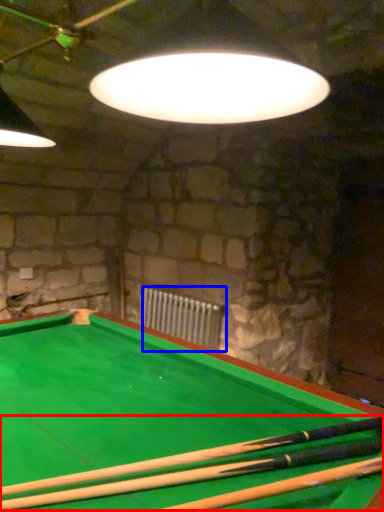
Question: Which object is closer to the camera taking this photo, cue (highlighted by a red box) or radiator (highlighted by a blue box)?

Choices:
 (A) cue
 (B) radiator

Answer: (A)